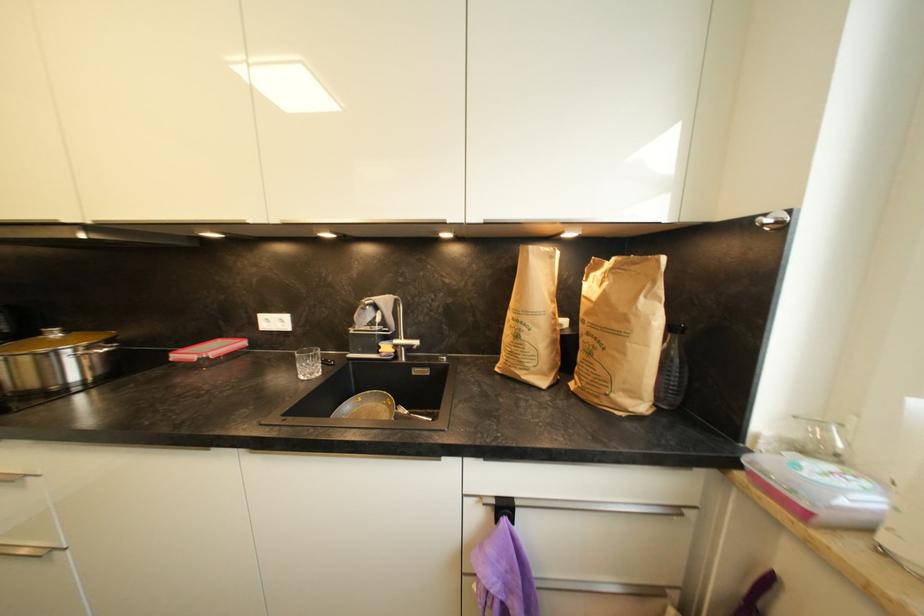
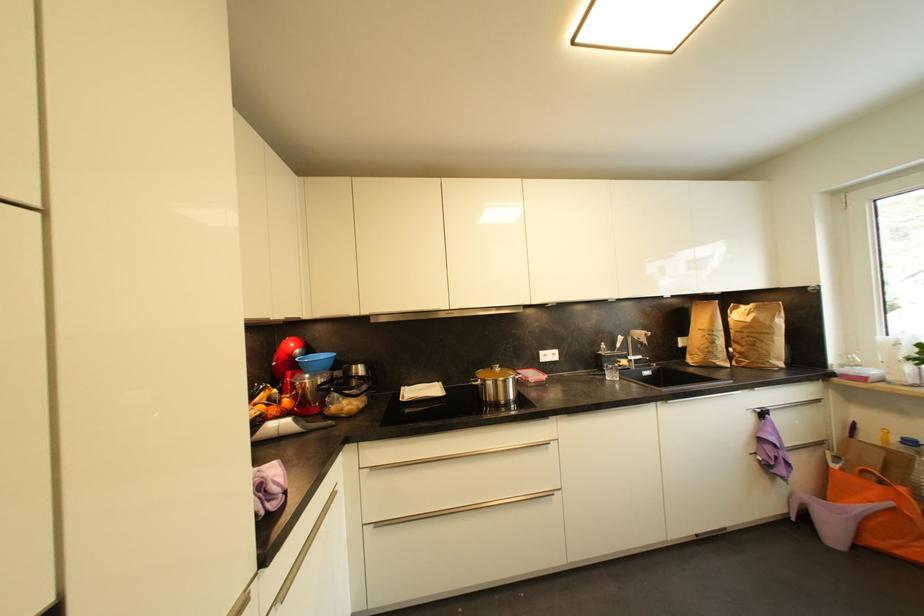
In the second image, find the point that corresponds to pixel 521 338 in the first image.

(718, 345)